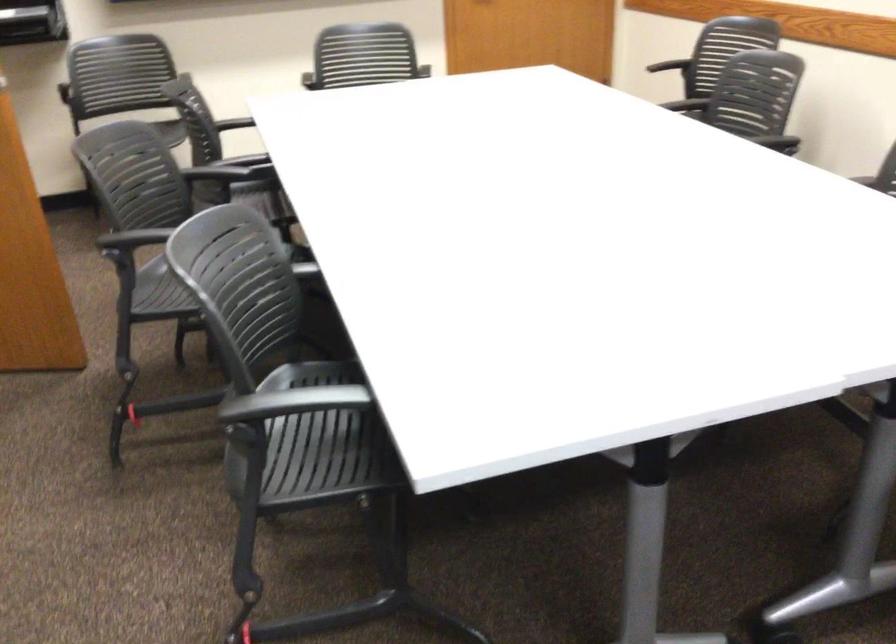
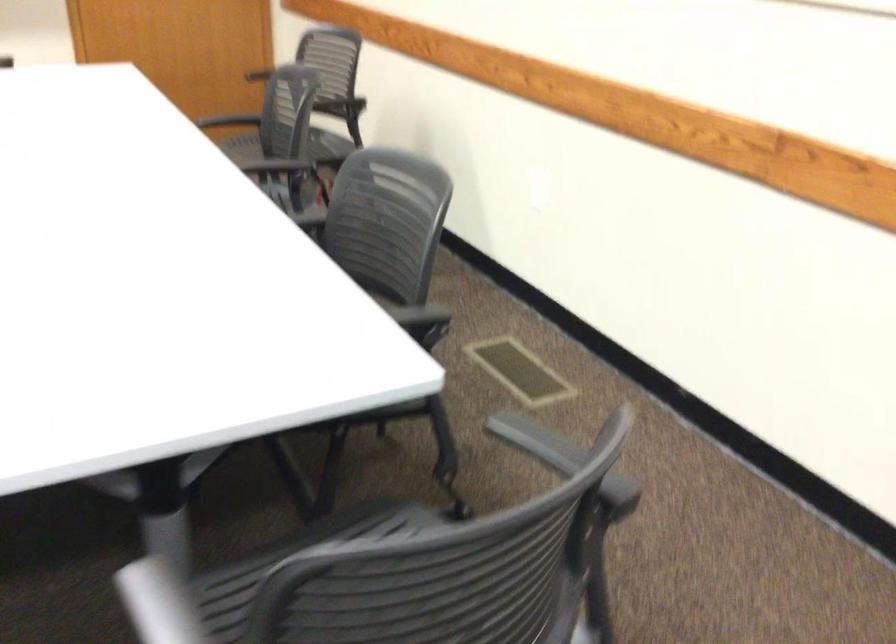
Question: How did the camera likely rotate?

Choices:
 (A) Left
 (B) Right
 (C) Up
 (D) Down

Answer: (B)